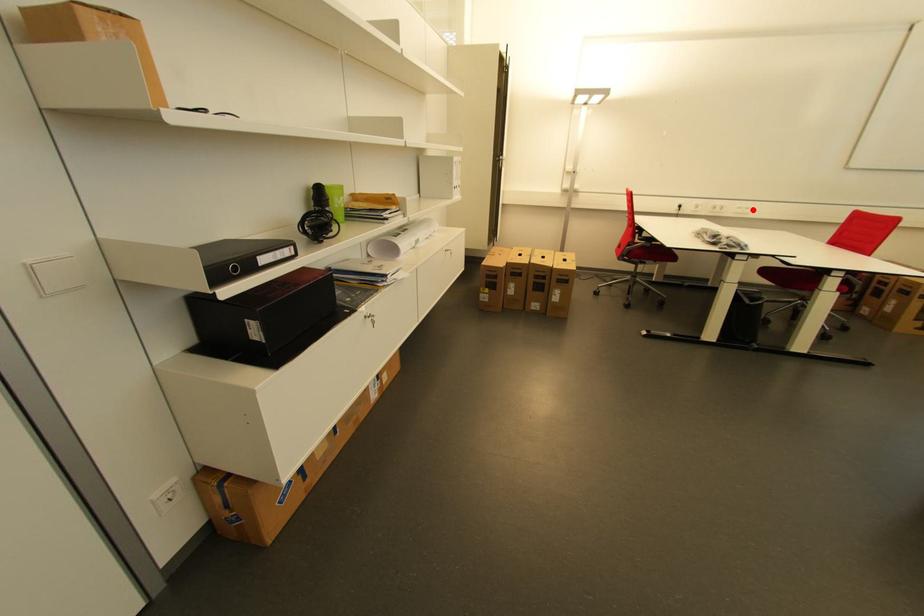
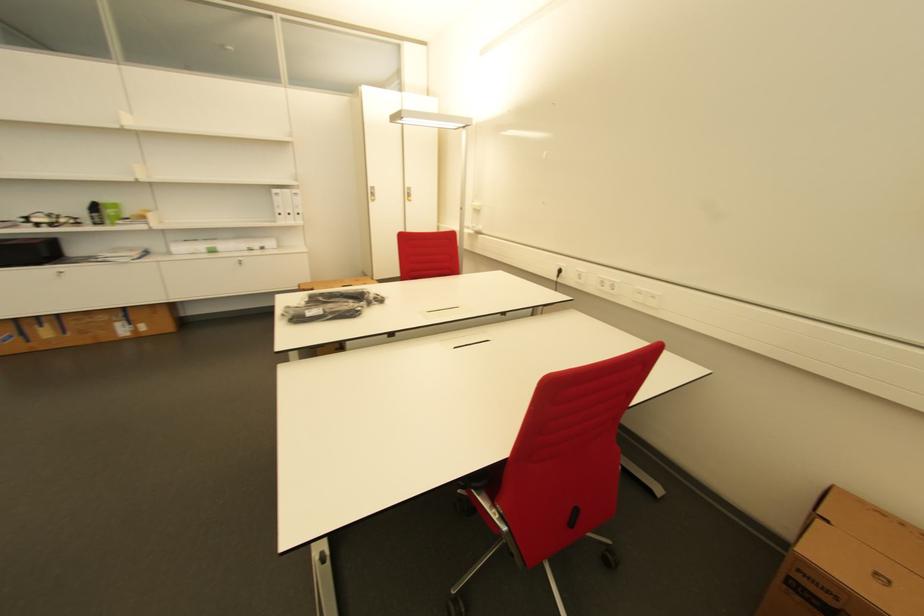
Find the pixel in the second image that matches the highlighted location in the first image.

(659, 299)